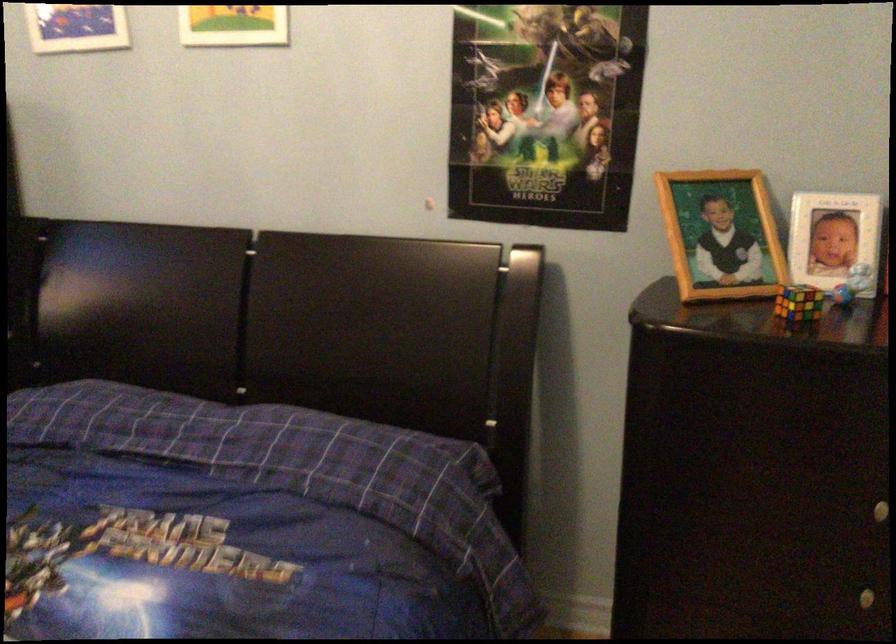
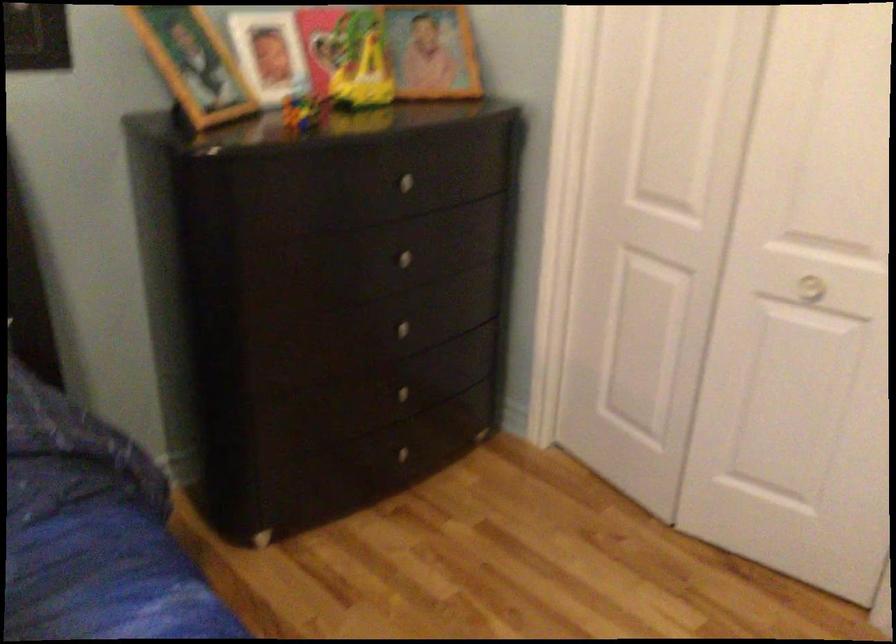
First-person continuous shooting, in which direction is the camera rotating?

The rotation direction of the camera is right-down.